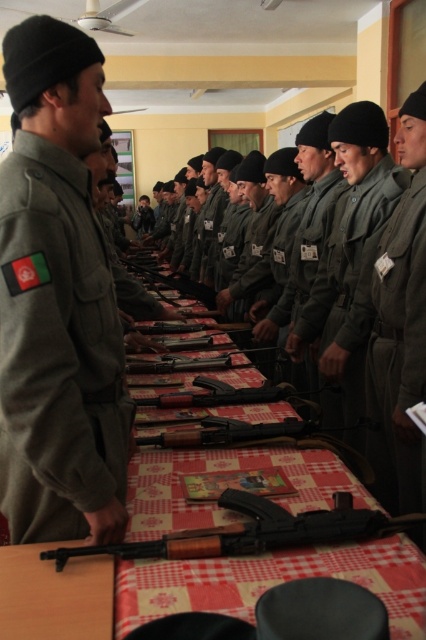
Is black plastic shotgun at lower center closer to camera compared to matte black shotgun at center?

Yes, it is in front of matte black shotgun at center.

Describe the element at coordinates (255, 531) in the screenshot. I see `black plastic shotgun at lower center` at that location.

The height and width of the screenshot is (640, 426). Describe the element at coordinates (255, 531) in the screenshot. I see `black plastic shotgun at lower center` at that location.

Where is `black plastic shotgun at lower center`? The height and width of the screenshot is (640, 426). black plastic shotgun at lower center is located at coordinates click(255, 531).

Is green matte uniform at center closer to the viewer compared to black plastic shotgun at lower center?

That is False.

Between green matte uniform at center and black plastic shotgun at lower center, which one is positioned lower?

black plastic shotgun at lower center

Measure the distance between green matte uniform at center and camera.

green matte uniform at center and camera are 2.01 meters apart.

Find the location of `green matte uniform at center`. green matte uniform at center is located at coordinates (348, 285).

Is point (29, 326) less distant than point (322, 365)?

Yes, point (29, 326) is in front of point (322, 365).

Which is behind, point (60, 516) or point (379, 195)?

The point (379, 195) is behind.

Where is `green matte uniform at left`? This screenshot has height=640, width=426. green matte uniform at left is located at coordinates (57, 349).

At what (x,y) coordinates should I click in order to perform the action: click on green matte uniform at left. Please return your answer as a coordinate pair (x, y). This screenshot has height=640, width=426. Looking at the image, I should click on (57, 349).